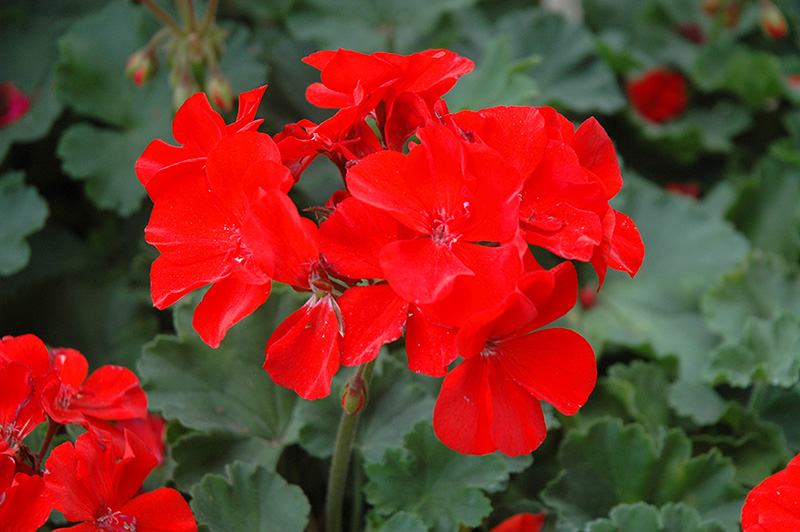
Find the location of `plant`. plant is located at coordinates (614, 436).